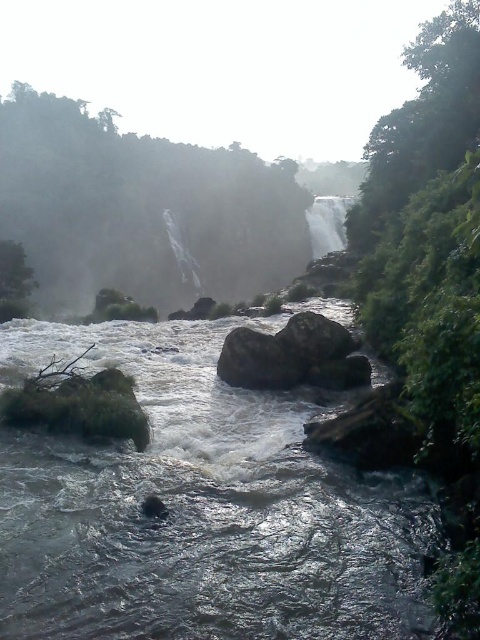
At what (x,y) coordinates should I click in order to perform the action: click on dark gray stone stream at center. Please return your answer as a coordinate pair (x, y). The width and height of the screenshot is (480, 640). Looking at the image, I should click on (200, 508).

What do you see at coordinates (200, 508) in the screenshot? I see `dark gray stone stream at center` at bounding box center [200, 508].

Find the location of a particular element. The height and width of the screenshot is (640, 480). dark gray stone stream at center is located at coordinates (200, 508).

Looking at this image, does gray rough rock at center appear under translucent white water at center?

Yes.

Does gray rough rock at center have a smaller size compared to translucent white water at center?

Indeed, gray rough rock at center has a smaller size compared to translucent white water at center.

Does point (323, 355) come in front of point (325, 218)?

That is True.

Identify the location of gray rough rock at center. The height and width of the screenshot is (640, 480). (314, 337).

Who is taller, dark gray stone stream at center or smooth rock at center?

Standing taller between the two is dark gray stone stream at center.

Does dark gray stone stream at center have a greater width compared to smooth rock at center?

Indeed, dark gray stone stream at center has a greater width compared to smooth rock at center.

Which is in front, point (288, 490) or point (324, 385)?

Positioned in front is point (288, 490).

This screenshot has width=480, height=640. I want to click on dark gray stone stream at center, so tap(200, 508).